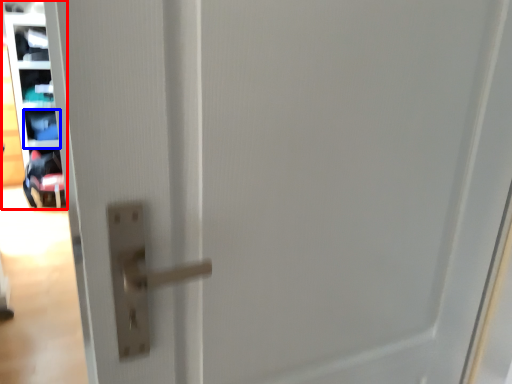
Question: Which object appears farthest to the camera in this image, shelf (highlighted by a red box) or shelf (highlighted by a blue box)?

Choices:
 (A) shelf
 (B) shelf

Answer: (B)